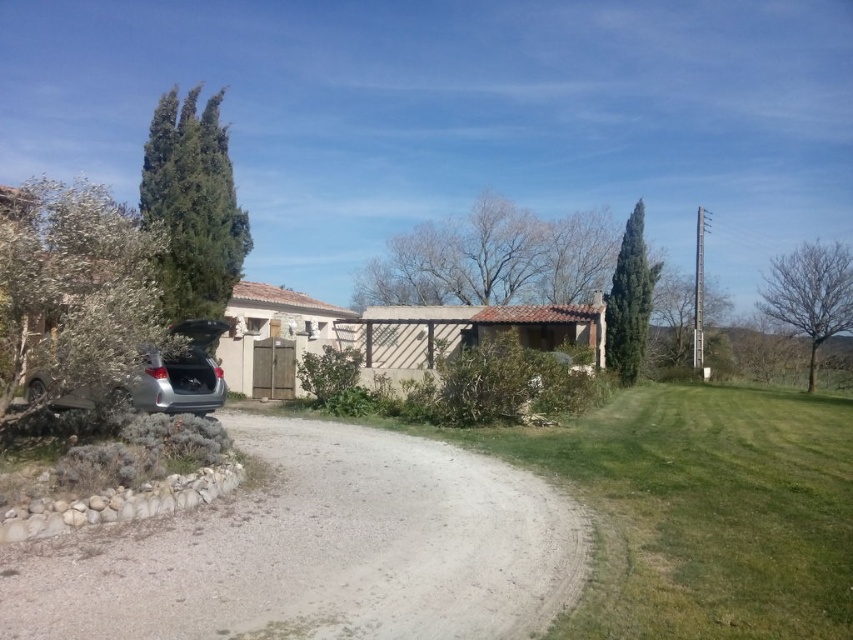
Question: Considering the relative positions of gray gravel driveway at lower left and satin silver car at left in the image provided, where is gray gravel driveway at lower left located with respect to satin silver car at left?

Choices:
 (A) right
 (B) left

Answer: (A)

Question: Does gray gravel driveway at lower left have a smaller size compared to satin silver car at left?

Choices:
 (A) no
 (B) yes

Answer: (B)

Question: Is gray gravel driveway at lower left closer to camera compared to satin silver car at left?

Choices:
 (A) yes
 (B) no

Answer: (A)

Question: Which of the following is the closest to the observer?

Choices:
 (A) gray gravel driveway at lower left
 (B) satin silver car at left

Answer: (A)

Question: Which of the following is the farthest from the observer?

Choices:
 (A) satin silver car at left
 (B) gray gravel driveway at lower left

Answer: (A)